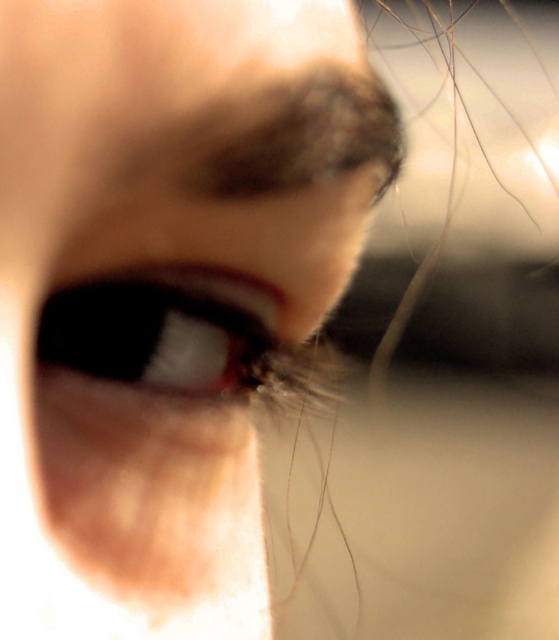
Question: Can you confirm if pink glossy tongue at center is positioned to the right of satin black eye at center?

Choices:
 (A) no
 (B) yes

Answer: (B)

Question: Which of the following is the farthest from the observer?

Choices:
 (A) satin black eye at center
 (B) pink glossy tongue at center

Answer: (A)

Question: Which of the following is the farthest from the observer?

Choices:
 (A) (181, 298)
 (B) (168, 96)

Answer: (A)

Question: Is pink glossy tongue at center closer to the viewer compared to satin black eye at center?

Choices:
 (A) no
 (B) yes

Answer: (B)

Question: Among these points, which one is farthest from the camera?

Choices:
 (A) (135, 353)
 (B) (102, 557)

Answer: (A)

Question: Is pink glossy tongue at center to the right of satin black eye at center from the viewer's perspective?

Choices:
 (A) no
 (B) yes

Answer: (B)